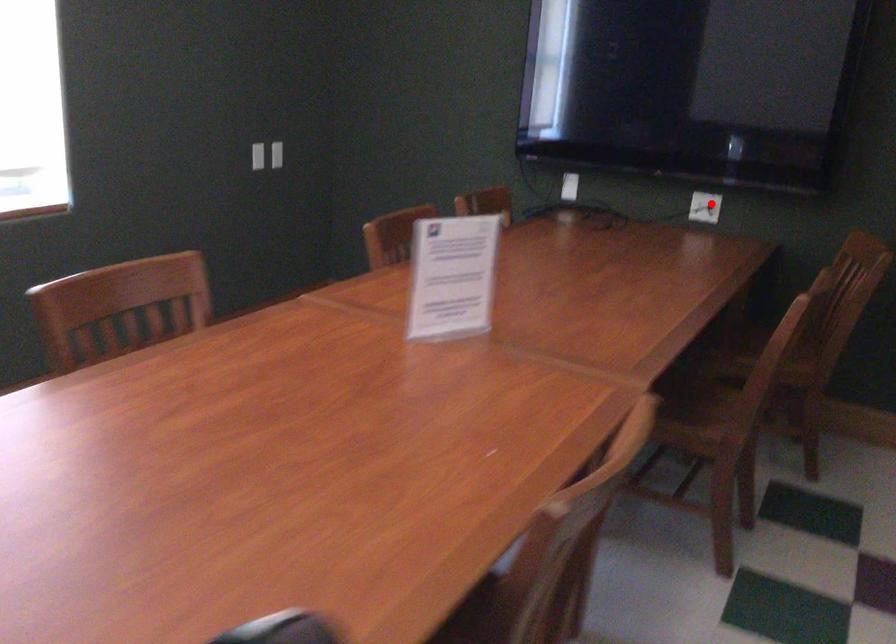
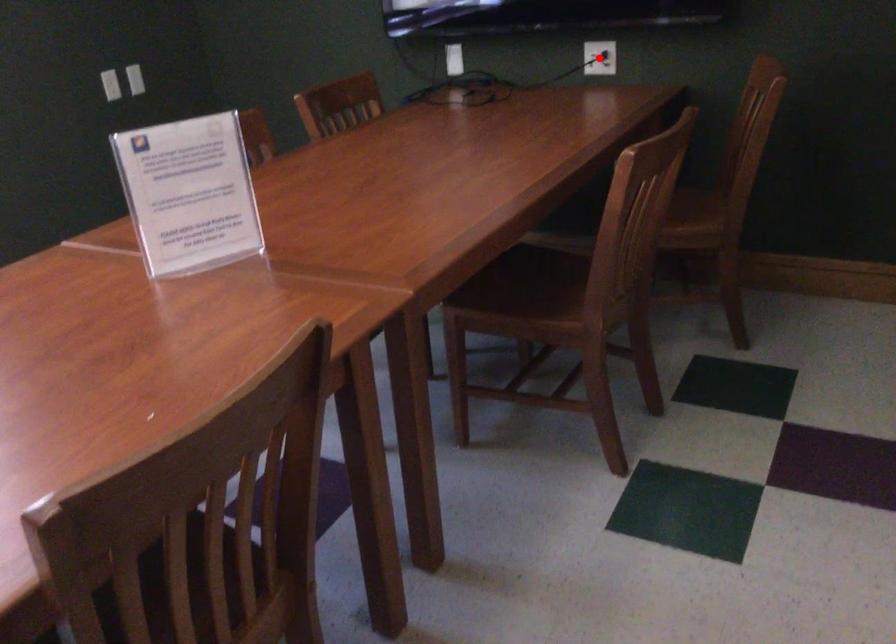
I am providing you with two images of the same scene from different viewpoints. A red point is marked on the first image and another point is marked on the second image. Is the marked point in image1 the same physical position as the marked point in image2?

Yes